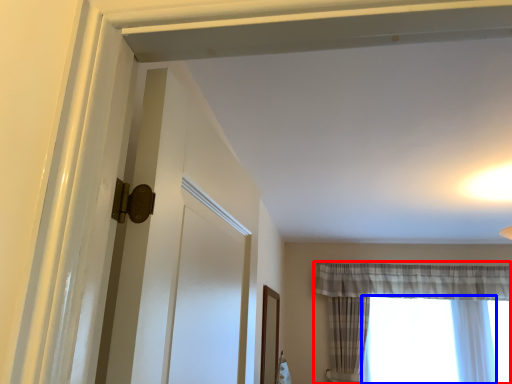
Question: Which point is further to the camera, curtain (highlighted by a red box) or window (highlighted by a blue box)?

Choices:
 (A) curtain
 (B) window

Answer: (B)